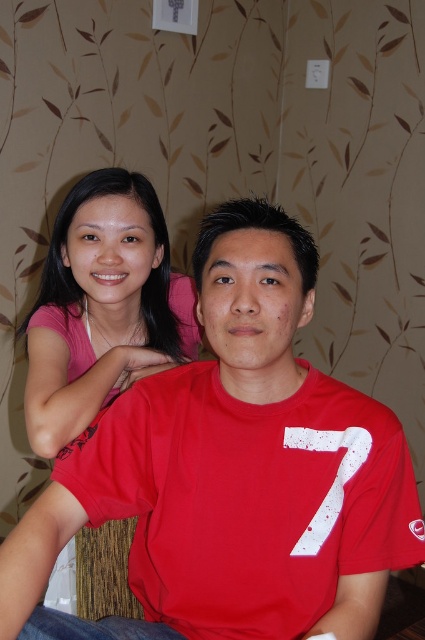
You are standing in the room and want to place a small plant between the two points, point 1 at (251,490) and point 2 at (70,216). Considering their positions, which point should the plant be closer to to ensure it is in front of the other point?

The plant should be placed closer to point 1 at (251,490) because it is in front of point 2 at (70,216).